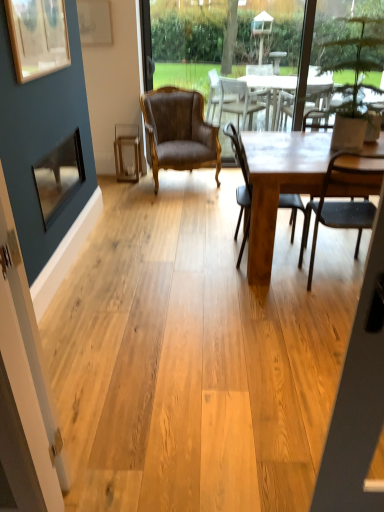
Locate an element on the screen. vacant area situated to the left side of matte brown chair at center, which appears as the third chair when viewed from the back is located at coordinates (266, 296).